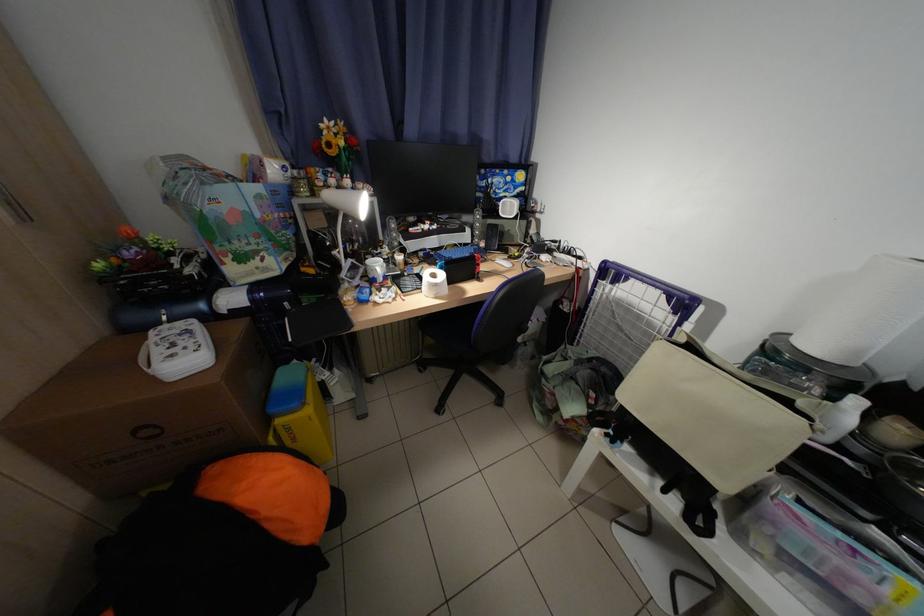
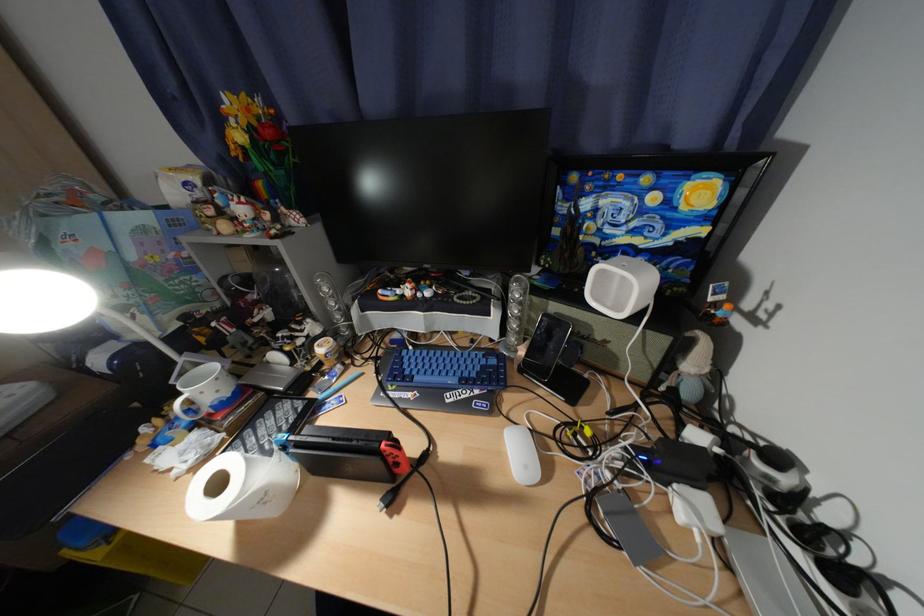
In the second image, find the point that corresponds to point (493, 246) in the first image.

(533, 354)